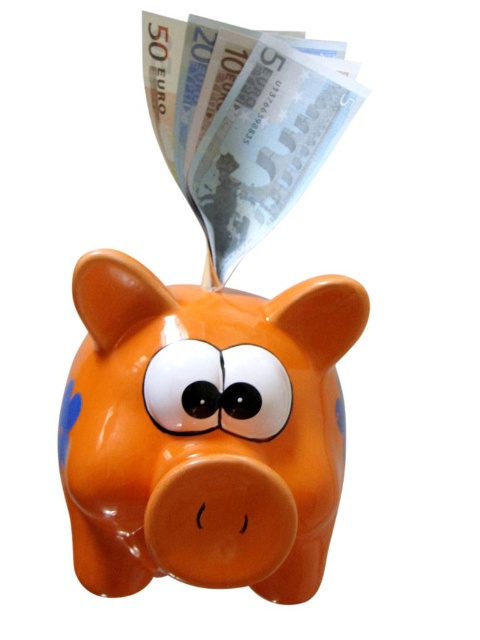
Question: Considering the relative positions of glossy ceramic piggy bank at center and silver metallic banknotes at upper center in the image provided, where is glossy ceramic piggy bank at center located with respect to silver metallic banknotes at upper center?

Choices:
 (A) below
 (B) above

Answer: (A)

Question: Which point appears closest to the camera in this image?

Choices:
 (A) (173, 577)
 (B) (192, 202)

Answer: (A)

Question: Can you confirm if glossy ceramic piggy bank at center is positioned to the left of silver metallic banknotes at upper center?

Choices:
 (A) no
 (B) yes

Answer: (B)

Question: Is glossy ceramic piggy bank at center smaller than silver metallic banknotes at upper center?

Choices:
 (A) no
 (B) yes

Answer: (A)

Question: Which object appears farthest from the camera in this image?

Choices:
 (A) silver metallic banknotes at upper center
 (B) glossy ceramic piggy bank at center

Answer: (A)